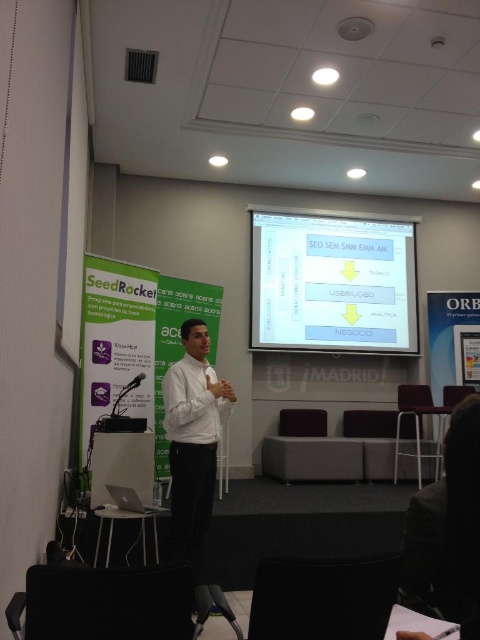
You are an event organizer who needs to adjust the lighting for a presentation. The room has a white glossy projector screen at upper center and a speaker wearing a white shirt at center. To ensure the projector screen is visible without glare, which object should you position closer to the light source?

The white glossy projector screen at upper center should be positioned closer to the light source because it is farther away from the white shirt at center, and adjusting its proximity to the light can reduce glare and improve visibility.

You are standing at the back of the conference room and want to walk to the speaker. Which point should you walk towards first, point (409,557) or point (183,515)?

You should walk towards point (183,515) first because point (409,557) is in front of point (183,515). Since you are at the back, moving towards the closer point would be more efficient.

You are an attendee at the presentation. You notice the white glossy projector screen at upper center and the dark brown hair at lower right. Which object takes up more space in the image?

The white glossy projector screen at upper center is bigger than dark brown hair at lower right, so it takes up more space in the image.